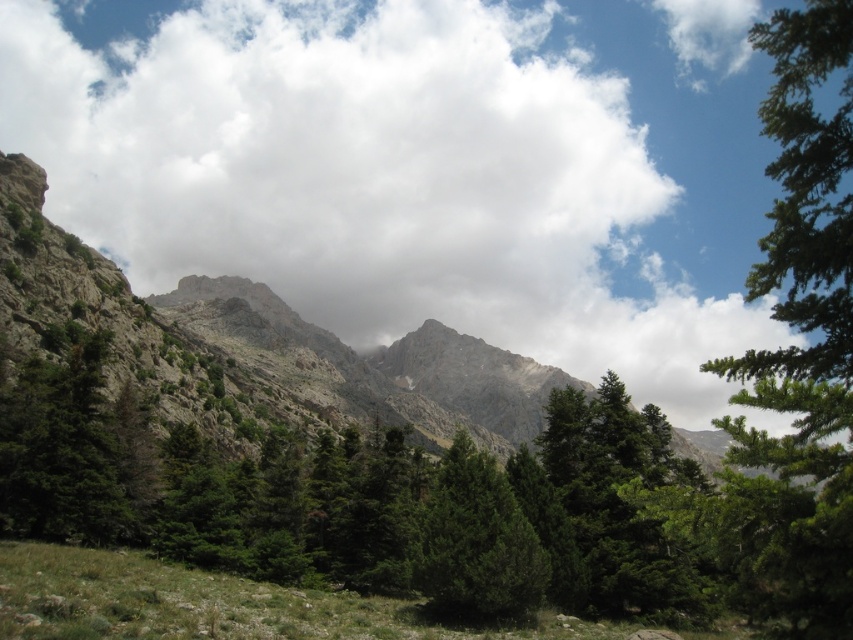
Question: Based on their relative distances, which object is nearer to the green matte tree at center?

Choices:
 (A) green matte tree at left
 (B) white fluffy cloud at upper center

Answer: (A)

Question: Does white fluffy cloud at upper center have a greater width compared to green matte tree at center?

Choices:
 (A) yes
 (B) no

Answer: (A)

Question: From the image, what is the correct spatial relationship of white fluffy cloud at upper center in relation to green matte tree at left?

Choices:
 (A) right
 (B) left

Answer: (B)

Question: Based on their relative distances, which object is nearer to the green matte tree at center?

Choices:
 (A) green matte tree at left
 (B) white fluffy cloud at upper center

Answer: (A)

Question: Can you confirm if green matte tree at left is positioned to the right of green matte tree at center?

Choices:
 (A) yes
 (B) no

Answer: (B)

Question: Among these points, which one is farthest from the camera?

Choices:
 (A) (41, 433)
 (B) (291, 3)
 (C) (520, 612)

Answer: (B)